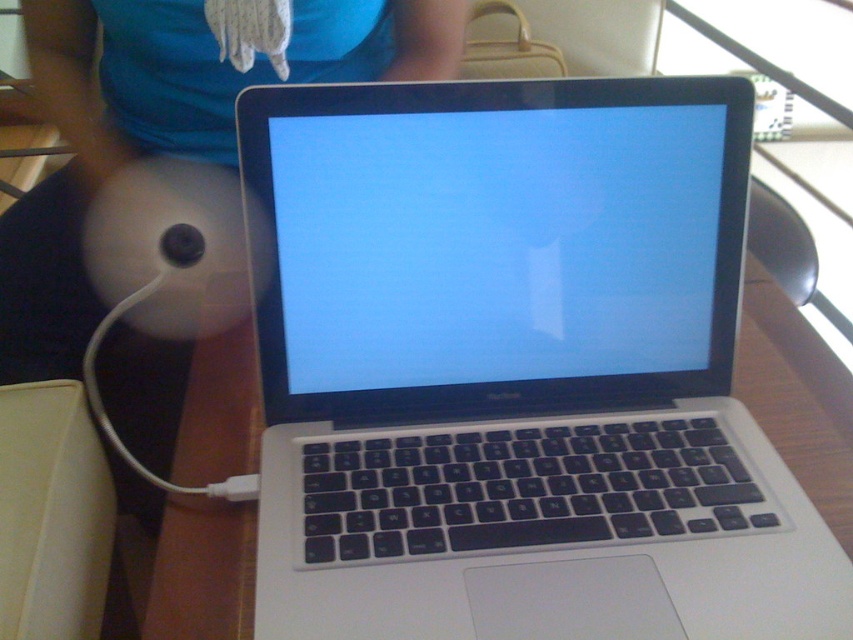
Where is the silver metallic laptop at center located in the image?

The silver metallic laptop at center is located at point (517, 371).

Based on the photo, you are organizing a desk and need to stack items vertically. You have a silver metallic laptop at center and a matte white plush at center. Which item should you place at the bottom of the stack to ensure stability?

The silver metallic laptop at center has a lesser height compared to matte white plush at center, so you should place the matte white plush at center at the bottom of the stack for better stability.

You are a technician trying to locate the matte plastic screen at center on a MacBook. According to the coordinates provided, where would you find it on the MacBook?

The matte plastic screen at center is located at point coordinates (x=496, y=248) on the MacBook.